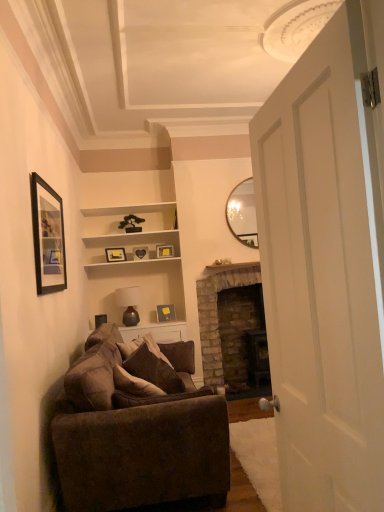
Question: From a real-world perspective, is matte gold picture frame at center, the fourth picture frame from the back, above or below matte gold picture frame at center, the 3th picture frame when ordered from top to bottom?

Choices:
 (A) above
 (B) below

Answer: (B)

Question: Considering the positions of matte gold picture frame at center, marked as the fourth picture frame in a top-to-bottom arrangement, and matte gold picture frame at center, the fourth picture frame from the front, in the image, is matte gold picture frame at center, marked as the fourth picture frame in a top-to-bottom arrangement, bigger or smaller than matte gold picture frame at center, the fourth picture frame from the front,?

Choices:
 (A) small
 (B) big

Answer: (A)

Question: Which object is positioned farthest from the brown fabric pillow at center?

Choices:
 (A) black matte picture frame at upper left, the 1th picture frame in the front-to-back sequence
 (B) green leafy plant at upper center
 (C) brick fireplace at center
 (D) matte gold picture frame at center, the fourth picture frame from the front
 (E) white matte door at right

Answer: (B)

Question: Based on their relative distances, which object is farther from the matte brown glass lamp at center?

Choices:
 (A) brown fabric pillow at center
 (B) brick fireplace at center
 (C) matte gold picture frame at center, marked as the fourth picture frame in a top-to-bottom arrangement
 (D) green leafy plant at upper center
 (E) white matte shelves at upper center

Answer: (A)